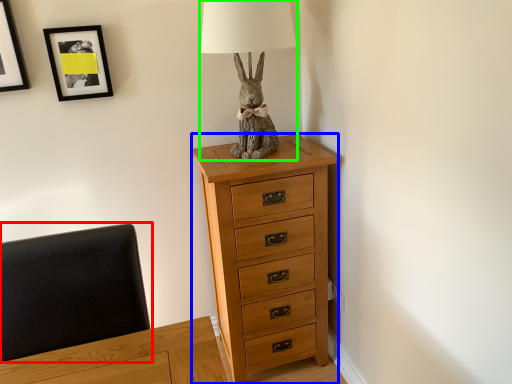
Question: Which is farther away from swivel chair (highlighted by a red box)? chest of drawers (highlighted by a blue box) or table lamp (highlighted by a green box)?

Choices:
 (A) chest of drawers
 (B) table lamp

Answer: (B)